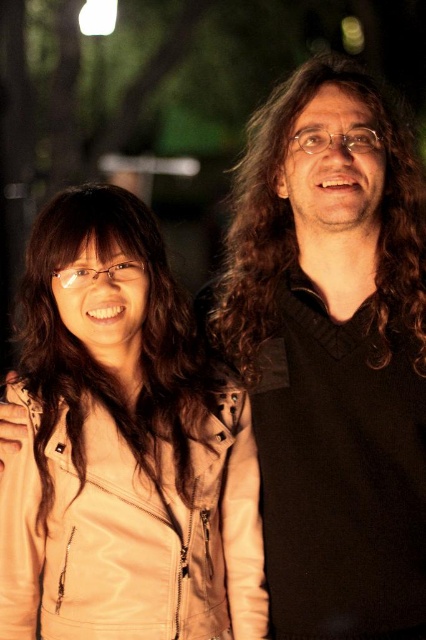
Which is behind, point (273, 280) or point (95, 324)?

The point (273, 280) is more distant.

Identify the location of black matte sweater at right. This screenshot has width=426, height=640. (333, 353).

Find the location of a particular element. Image resolution: width=426 pixels, height=640 pixels. black matte sweater at right is located at coordinates (333, 353).